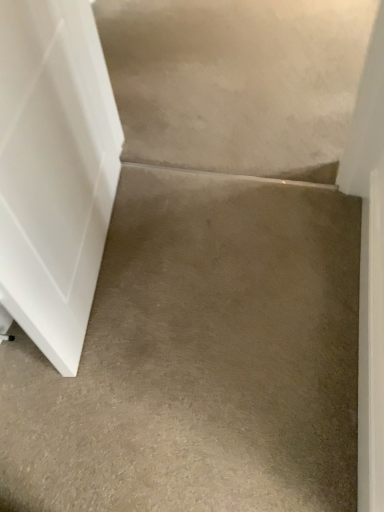
Question: Should I look upward or downward to see white matte door at left?

Choices:
 (A) up
 (B) down

Answer: (A)